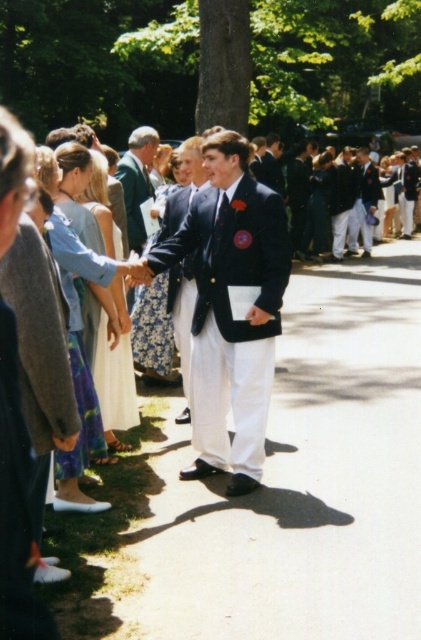
Question: Is matte blue dress at center further to camera compared to white satin dress at center?

Choices:
 (A) yes
 (B) no

Answer: (B)

Question: Which point is farther from the camera taking this photo?

Choices:
 (A) (120, 333)
 (B) (271, 179)

Answer: (B)

Question: Which point is closer to the camera taking this photo?

Choices:
 (A) (368, 182)
 (B) (298, 156)
 (C) (231, 252)
 (D) (151, 356)

Answer: (C)

Question: In this image, where is floral fabric dress at center located relative to dark blue suit at center?

Choices:
 (A) below
 (B) above

Answer: (A)

Question: Does matte blue dress at center come in front of green wool blazer at center?

Choices:
 (A) yes
 (B) no

Answer: (A)

Question: Which point appears farthest from the camera in this image?

Choices:
 (A) (159, 209)
 (B) (114, 256)
 (C) (365, 208)
 (D) (271, 376)

Answer: (C)